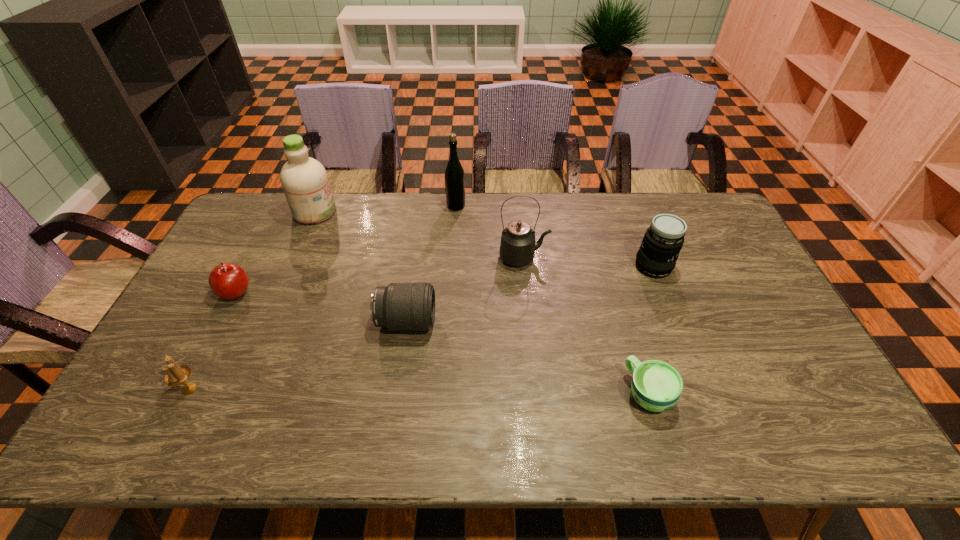
Locate an element on the screen. cleansing agent located at the far edge is located at coordinates (305, 183).

Locate an element on the screen. beer bottle positioned at the far edge is located at coordinates (454, 176).

Locate an element on the screen. object at the near edge is located at coordinates (656, 386).

I want to click on candle holder positioned at the left edge, so click(175, 375).

In order to click on apple at the left edge in this screenshot , I will do `click(227, 281)`.

Find the location of a particular element. vacant area at the far edge is located at coordinates [x=636, y=227].

Where is `vacant area at the near edge`? vacant area at the near edge is located at coordinates (257, 426).

What are the coordinates of `vacant region at the left edge of the desktop` in the screenshot? It's located at (161, 396).

This screenshot has height=540, width=960. In the image, there is a desktop. What are the coordinates of `vacant space at the right edge` in the screenshot? It's located at (715, 299).

I want to click on free space at the far left corner, so click(x=274, y=206).